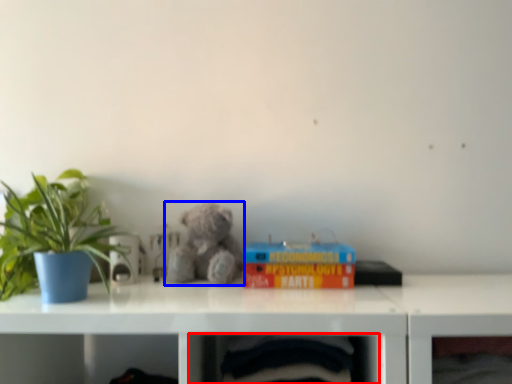
Question: Which of the following is the farthest to the observer, shelf (highlighted by a red box) or teddy bear (highlighted by a blue box)?

Choices:
 (A) shelf
 (B) teddy bear

Answer: (B)